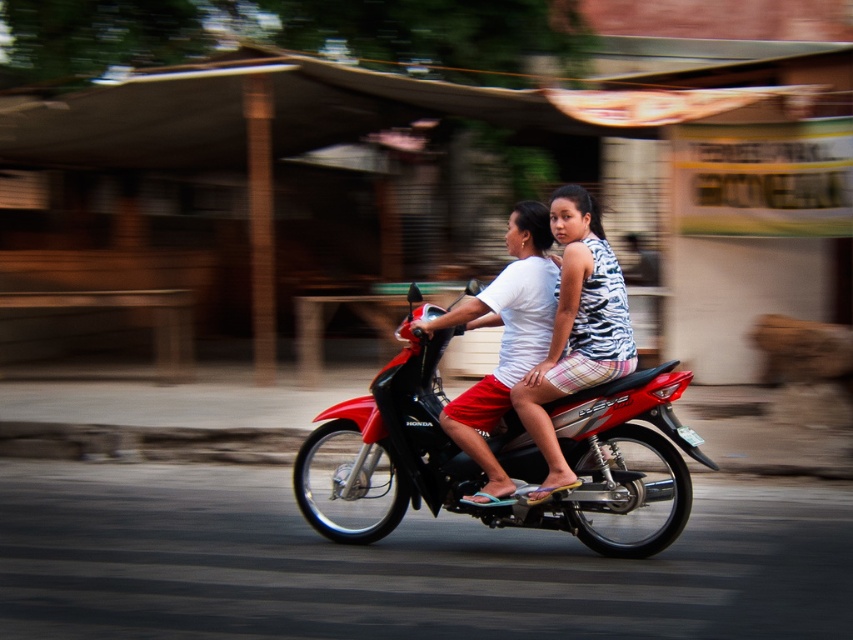
Question: Does patterned fabric shirt at center come in front of white matte shirt at center?

Choices:
 (A) no
 (B) yes

Answer: (B)

Question: Which of the following is the closest to the observer?

Choices:
 (A) white matte shirt at center
 (B) shiny red motorcycle at center
 (C) patterned fabric shirt at center

Answer: (B)

Question: Is patterned fabric shirt at center below white matte shirt at center?

Choices:
 (A) yes
 (B) no

Answer: (B)

Question: Which is farther from the shiny red motorcycle at center?

Choices:
 (A) patterned fabric shirt at center
 (B) white matte shirt at center

Answer: (A)

Question: Which object is the farthest from the shiny red motorcycle at center?

Choices:
 (A) patterned fabric shirt at center
 (B) white matte shirt at center

Answer: (A)

Question: Where is patterned fabric shirt at center located in relation to white matte shirt at center in the image?

Choices:
 (A) below
 (B) above

Answer: (B)